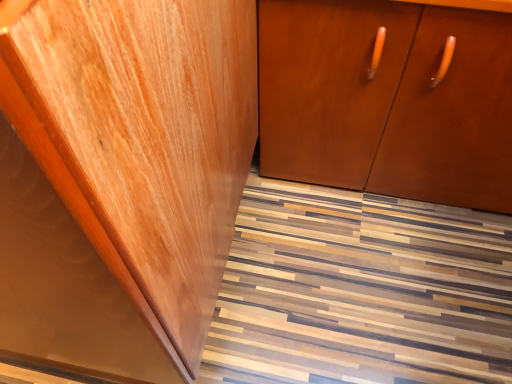
Question: Does glossy wood cabinet at left, which appears as the 1th cabinetry when viewed from the left, lie behind matte brown cabinet at center, acting as the first cabinetry starting from the right?

Choices:
 (A) yes
 (B) no

Answer: (B)

Question: Can you confirm if glossy wood cabinet at left, which is the 2th cabinetry from right to left, is shorter than matte brown cabinet at center, acting as the first cabinetry starting from the right?

Choices:
 (A) no
 (B) yes

Answer: (A)

Question: Considering the relative sizes of glossy wood cabinet at left, which is the 2th cabinetry from right to left, and matte brown cabinet at center, acting as the first cabinetry starting from the right, in the image provided, is glossy wood cabinet at left, which is the 2th cabinetry from right to left, taller than matte brown cabinet at center, acting as the first cabinetry starting from the right,?

Choices:
 (A) yes
 (B) no

Answer: (A)

Question: Does glossy wood cabinet at left, which is the 2th cabinetry from right to left, lie in front of matte brown cabinet at center, which ranks as the 2th cabinetry in left-to-right order?

Choices:
 (A) yes
 (B) no

Answer: (A)

Question: From the image's perspective, is glossy wood cabinet at left, which is the 2th cabinetry from right to left, under matte brown cabinet at center, acting as the first cabinetry starting from the right?

Choices:
 (A) yes
 (B) no

Answer: (A)

Question: Considering the relative sizes of glossy wood cabinet at left, which is the 2th cabinetry from right to left, and matte brown cabinet at center, acting as the first cabinetry starting from the right, in the image provided, is glossy wood cabinet at left, which is the 2th cabinetry from right to left, thinner than matte brown cabinet at center, acting as the first cabinetry starting from the right,?

Choices:
 (A) yes
 (B) no

Answer: (A)

Question: Is matte brown cabinet at center, acting as the first cabinetry starting from the right, a part of wooden floor at lower center?

Choices:
 (A) no
 (B) yes

Answer: (A)

Question: Does wooden floor at lower center turn towards matte brown cabinet at center, acting as the first cabinetry starting from the right?

Choices:
 (A) yes
 (B) no

Answer: (B)

Question: Considering the relative sizes of wooden floor at lower center and matte brown cabinet at center, acting as the first cabinetry starting from the right, in the image provided, is wooden floor at lower center taller than matte brown cabinet at center, acting as the first cabinetry starting from the right,?

Choices:
 (A) yes
 (B) no

Answer: (B)

Question: From the image's perspective, would you say wooden floor at lower center is shown under matte brown cabinet at center, which ranks as the 2th cabinetry in left-to-right order?

Choices:
 (A) yes
 (B) no

Answer: (A)

Question: Does wooden floor at lower center have a greater width compared to matte brown cabinet at center, which ranks as the 2th cabinetry in left-to-right order?

Choices:
 (A) no
 (B) yes

Answer: (B)

Question: Can you confirm if wooden floor at lower center is positioned to the left of matte brown cabinet at center, acting as the first cabinetry starting from the right?

Choices:
 (A) no
 (B) yes

Answer: (B)

Question: From a real-world perspective, is glossy wood cabinet at left, which appears as the 1th cabinetry when viewed from the left, on top of wooden floor at lower center?

Choices:
 (A) yes
 (B) no

Answer: (A)